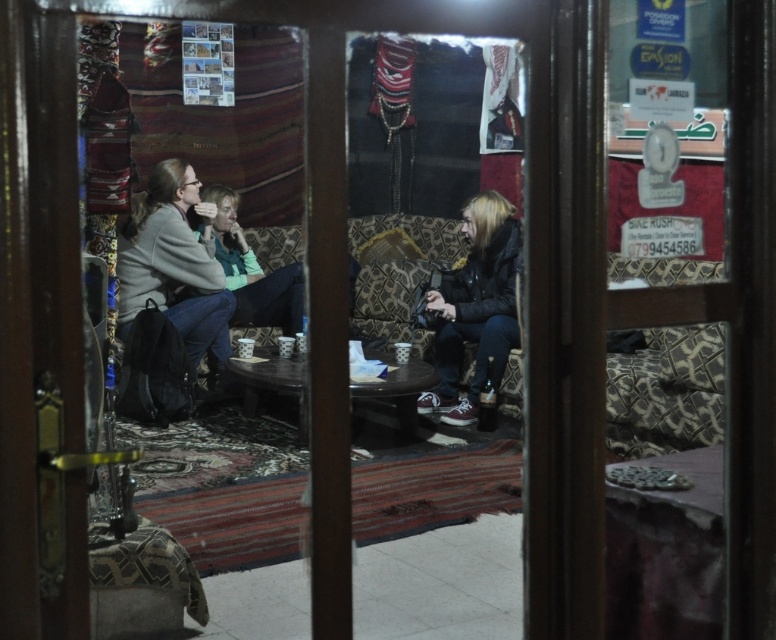
Question: Does light gray sweater at left lie in front of dark gray leather jacket at center?

Choices:
 (A) yes
 (B) no

Answer: (A)

Question: Does light gray sweater at left have a larger size compared to dark gray leather jacket at center?

Choices:
 (A) no
 (B) yes

Answer: (B)

Question: Which object appears closest to the camera in this image?

Choices:
 (A) dark gray leather jacket at center
 (B) light gray sweater at left

Answer: (B)

Question: Which point is farther from the camera taking this photo?

Choices:
 (A) (146, 276)
 (B) (469, 413)

Answer: (A)

Question: Is light gray sweater at left above dark gray leather jacket at center?

Choices:
 (A) no
 (B) yes

Answer: (B)